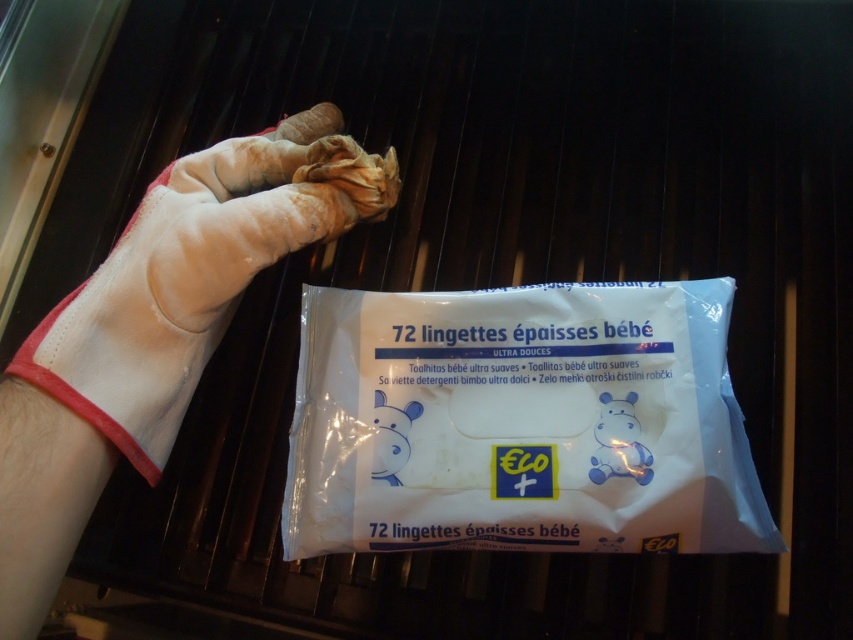
Question: Which point is farther to the camera?

Choices:
 (A) (195, 220)
 (B) (633, 340)

Answer: (B)

Question: Does white plastic wipes at center have a lesser width compared to white leather glove at upper left?

Choices:
 (A) no
 (B) yes

Answer: (A)

Question: Can you confirm if white plastic wipes at center is positioned below white leather glove at upper left?

Choices:
 (A) no
 (B) yes

Answer: (B)

Question: Which point is closer to the camera?

Choices:
 (A) white leather glove at upper left
 (B) white plastic wipes at center

Answer: (A)

Question: Does white plastic wipes at center have a lesser width compared to white leather glove at upper left?

Choices:
 (A) no
 (B) yes

Answer: (A)